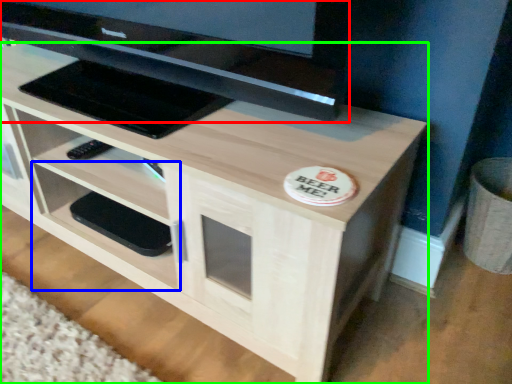
Question: Which object is the farthest from television (highlighted by a red box)? Choose among these: shelf (highlighted by a blue box) or desk (highlighted by a green box).

Choices:
 (A) shelf
 (B) desk

Answer: (A)